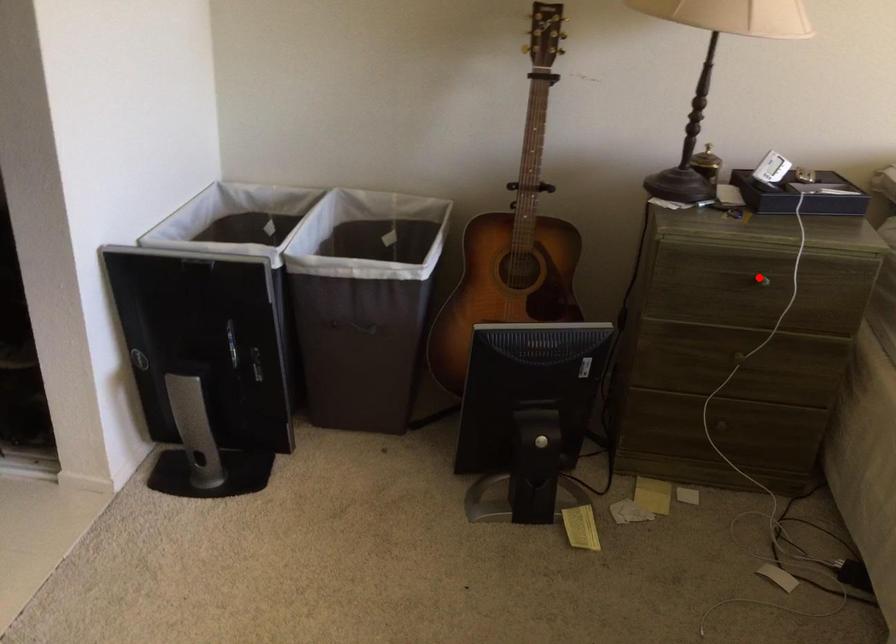
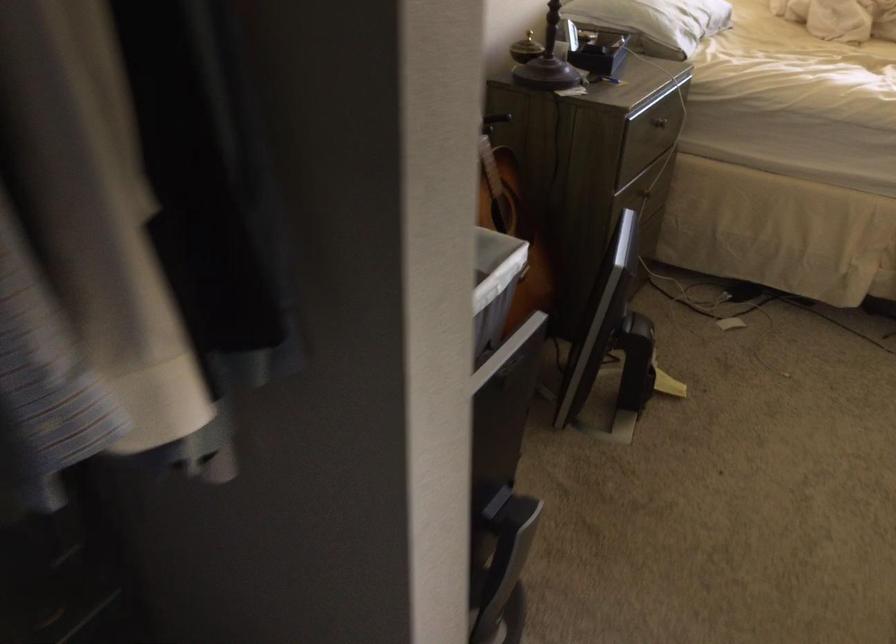
Question: I am providing you with two images of the same scene from different viewpoints. A red point is shown in image1. For the corresponding object point in image2, is it positioned nearer or farther from the camera?

Choices:
 (A) Nearer
 (B) Farther

Answer: (B)